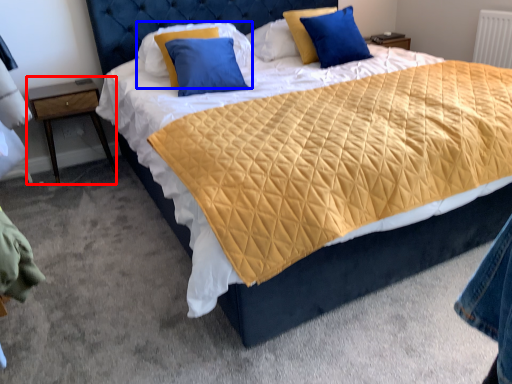
Question: Which object appears farthest to the camera in this image, nightstand (highlighted by a red box) or pillow (highlighted by a blue box)?

Choices:
 (A) nightstand
 (B) pillow

Answer: (A)